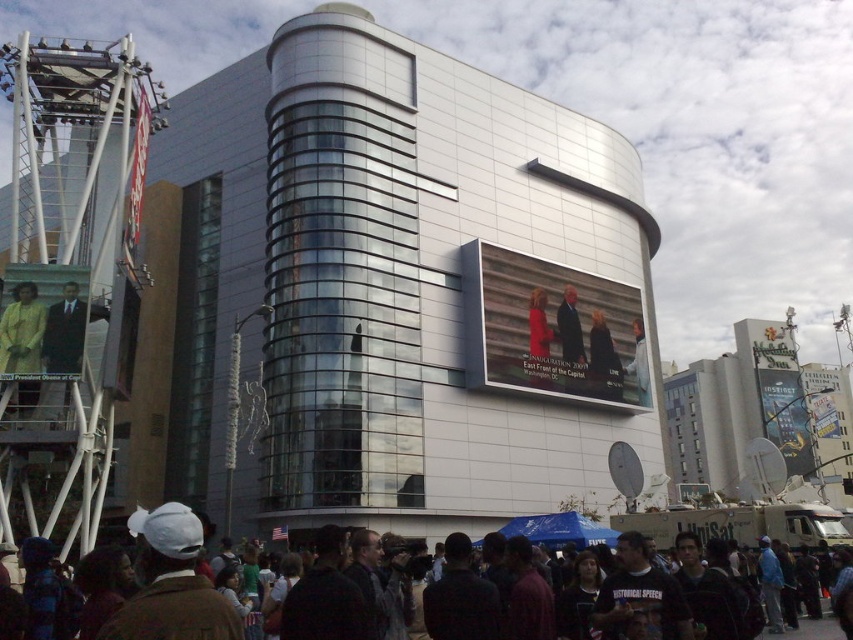
In the urban scene, there is a metallic silver sign at center and a light brown leather jacket at upper center. Which object is taller?

The metallic silver sign at center is taller than the light brown leather jacket at upper center.

You are a photographer standing in front of the curved building. You want to take a photo that includes both the metallic silver sign at center and the dark blue suit at center. Which object should you zoom in on to ensure both fit in the frame?

The metallic silver sign at center is wider than the dark blue suit at center, so you should zoom out to include both objects in the frame.

You are a photographer standing in the crowd in front of the modern curved building. You want to take a photo of the metallic silver sign at center. Considering your camera has a maximum focus range of 100 meters, will you be able to capture a clear image of the sign?

The metallic silver sign at center is 111.59 meters away from the viewer, which exceeds the camera maximum focus range of 100 meters. Therefore, you cannot capture a clear image of the sign.